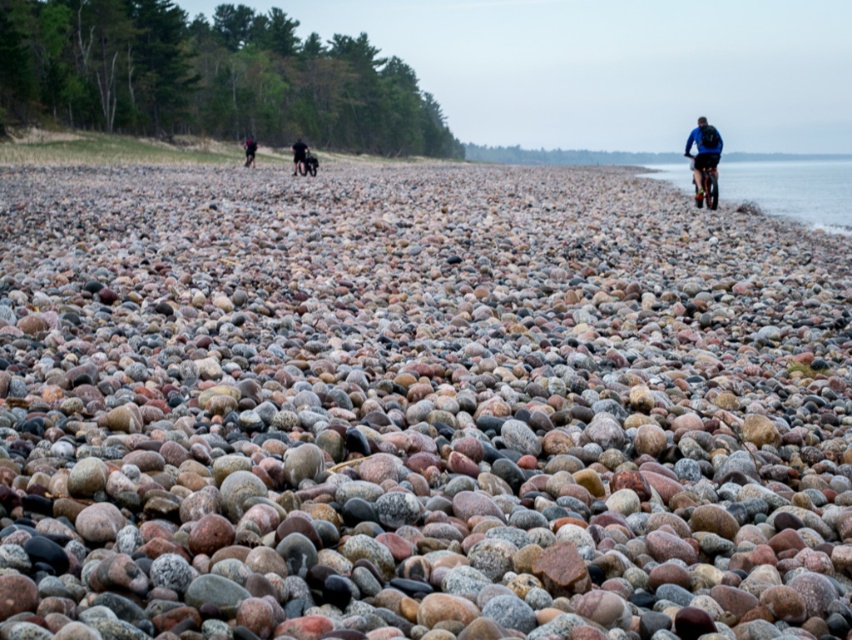
Which is behind, point (718, 138) or point (298, 156)?

Point (298, 156)

Is blue fabric jacket at right below dark blue fabric jacket at center?

Yes, blue fabric jacket at right is below dark blue fabric jacket at center.

What do you see at coordinates (703, 154) in the screenshot? I see `blue fabric jacket at right` at bounding box center [703, 154].

Locate an element on the screen. blue fabric jacket at right is located at coordinates (703, 154).

Does dark blue fabric jacket at center appear over black fabric pants at center?

No.

What do you see at coordinates (298, 156) in the screenshot?
I see `dark blue fabric jacket at center` at bounding box center [298, 156].

I want to click on dark blue fabric jacket at center, so click(298, 156).

Find the location of `speckled rock at center`. speckled rock at center is located at coordinates (416, 410).

Is speckled rock at center behind black fabric pants at center?

No, it is in front of black fabric pants at center.

Find the location of a particular element. The height and width of the screenshot is (640, 852). speckled rock at center is located at coordinates (416, 410).